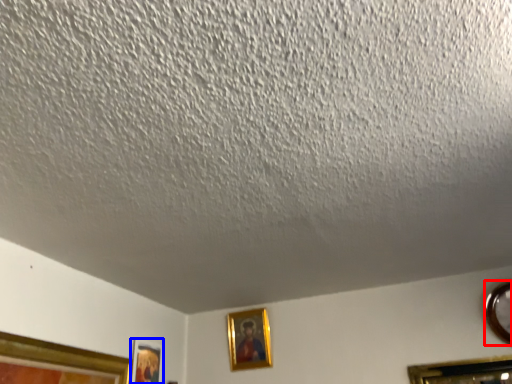
Question: Which object is further to the camera taking this photo, picture frame (highlighted by a red box) or picture frame (highlighted by a blue box)?

Choices:
 (A) picture frame
 (B) picture frame

Answer: (B)